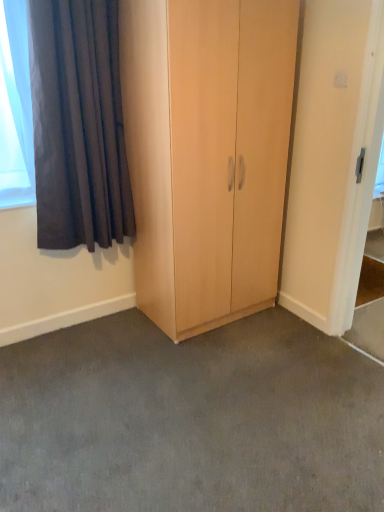
Question: Is light wood cupboard at center surrounding dark grey velvet curtain at upper left?

Choices:
 (A) no
 (B) yes

Answer: (A)

Question: Can you confirm if light wood cupboard at center is wider than dark grey velvet curtain at upper left?

Choices:
 (A) yes
 (B) no

Answer: (A)

Question: Can you confirm if light wood cupboard at center is positioned to the right of dark grey velvet curtain at upper left?

Choices:
 (A) yes
 (B) no

Answer: (A)

Question: Does light wood cupboard at center come in front of dark grey velvet curtain at upper left?

Choices:
 (A) no
 (B) yes

Answer: (B)

Question: From a real-world perspective, is light wood cupboard at center positioned over dark grey velvet curtain at upper left based on gravity?

Choices:
 (A) yes
 (B) no

Answer: (B)

Question: Looking at their shapes, would you say white glossy screen door at upper right is wider or thinner than light wood cupboard at center?

Choices:
 (A) wide
 (B) thin

Answer: (B)

Question: Looking at the image, does white glossy screen door at upper right seem bigger or smaller compared to light wood cupboard at center?

Choices:
 (A) big
 (B) small

Answer: (B)

Question: From a real-world perspective, is white glossy screen door at upper right above or below light wood cupboard at center?

Choices:
 (A) below
 (B) above

Answer: (A)

Question: Is white glossy screen door at upper right spatially inside light wood cupboard at center, or outside of it?

Choices:
 (A) inside
 (B) outside

Answer: (B)

Question: From the image's perspective, is white glossy screen door at upper right positioned above or below gray carpet at center?

Choices:
 (A) above
 (B) below

Answer: (A)

Question: Is white glossy screen door at upper right in front of or behind gray carpet at center in the image?

Choices:
 (A) front
 (B) behind

Answer: (B)

Question: Is white glossy screen door at upper right taller or shorter than gray carpet at center?

Choices:
 (A) short
 (B) tall

Answer: (B)

Question: Is white glossy screen door at upper right wider or thinner than gray carpet at center?

Choices:
 (A) wide
 (B) thin

Answer: (B)

Question: Considering the positions of gray carpet at center and white glossy screen door at upper right in the image, is gray carpet at center bigger or smaller than white glossy screen door at upper right?

Choices:
 (A) big
 (B) small

Answer: (A)

Question: Considering the relative positions of gray carpet at center and white glossy screen door at upper right in the image provided, is gray carpet at center to the left or to the right of white glossy screen door at upper right?

Choices:
 (A) right
 (B) left

Answer: (B)